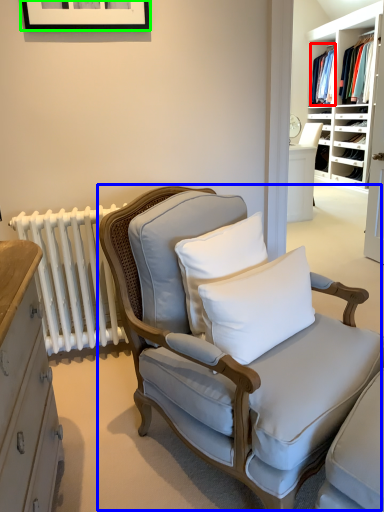
Question: Estimate the real-world distances between objects in this image. Which object is farther from clothing (highlighted by a red box), chair (highlighted by a blue box) or picture frame (highlighted by a green box)?

Choices:
 (A) chair
 (B) picture frame

Answer: (A)